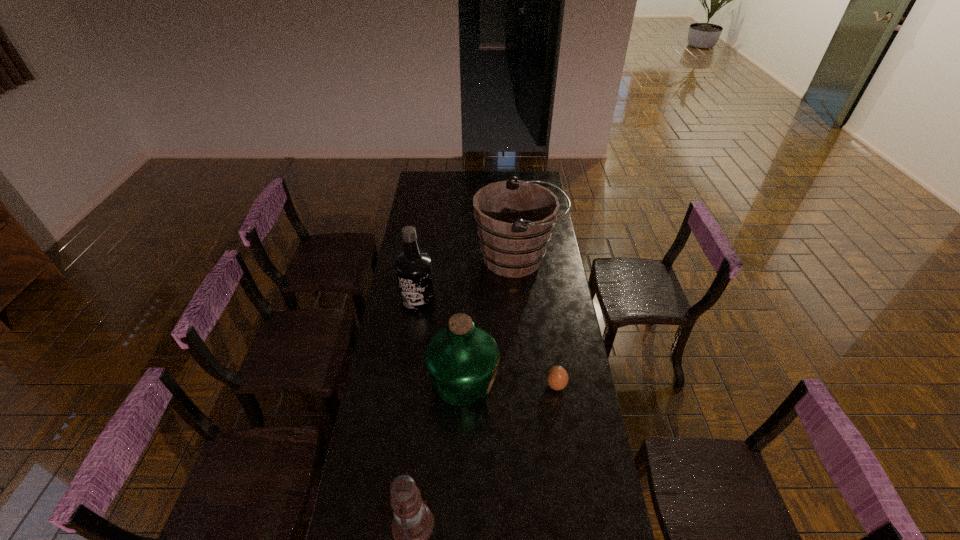
Where is `the second closest object to the oil lamp`? the second closest object to the oil lamp is located at coordinates (557, 378).

Identify the location of free space that satisfies the following two spatial constraints: 1. on the handle side of the bucket; 2. on the front label of the fourth nearest object. (521, 301).

Identify the location of vacant area that satisfies the following two spatial constraints: 1. on the handle side of the farthest object; 2. on the front label of the taller liquor. (521, 301).

At what (x,y) coordinates should I click in order to perform the action: click on free space that satisfies the following two spatial constraints: 1. on the front label of the shortest object; 2. on the left side of the fourth nearest object. Please return your answer as a coordinate pair (x, y). This screenshot has width=960, height=540. Looking at the image, I should click on (406, 386).